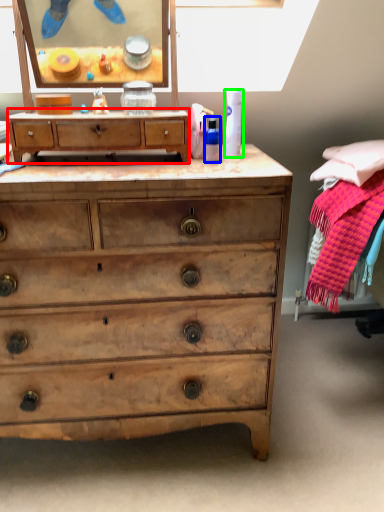
Question: Estimate the real-world distances between objects in this image. Which object is closer to chest of drawers (highlighted by a red box), toiletry (highlighted by a blue box) or toiletry (highlighted by a green box)?

Choices:
 (A) toiletry
 (B) toiletry

Answer: (A)